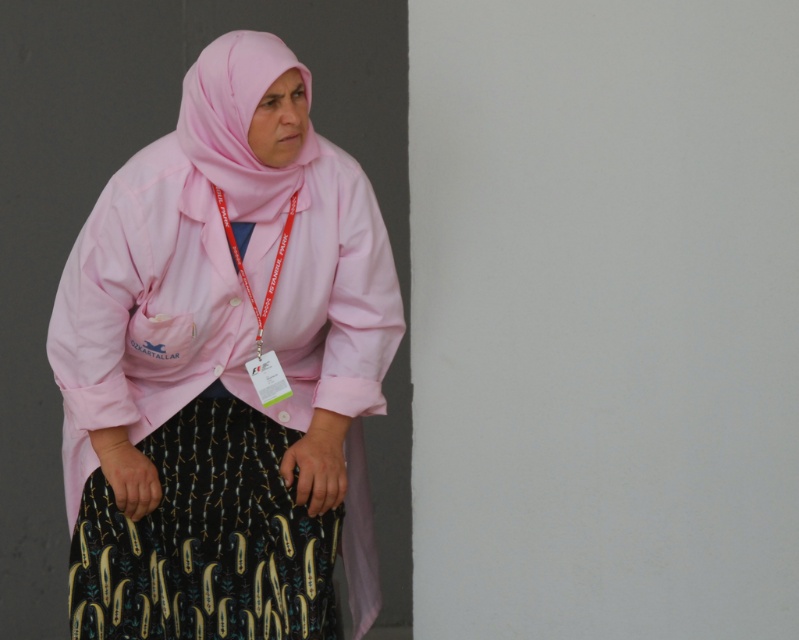
Is the position of pink fabric hijab at upper left less distant than that of pink fabric headscarf at upper center?

No, pink fabric hijab at upper left is behind pink fabric headscarf at upper center.

Between pink fabric hijab at upper left and pink fabric headscarf at upper center, which one has more height?

With more height is pink fabric hijab at upper left.

Where is `pink fabric hijab at upper left`? The image size is (799, 640). pink fabric hijab at upper left is located at coordinates (225, 369).